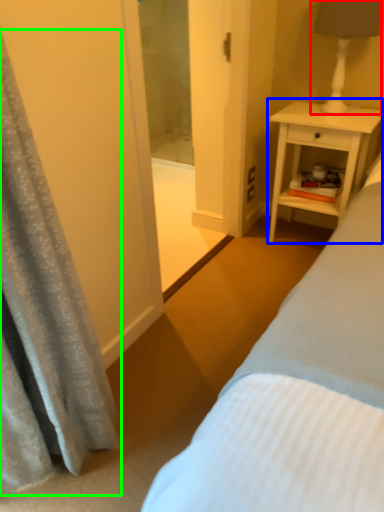
Question: Considering the real-world distances, which object is farthest from bedside lamp (highlighted by a red box)? nightstand (highlighted by a blue box) or curtain (highlighted by a green box)?

Choices:
 (A) nightstand
 (B) curtain

Answer: (B)